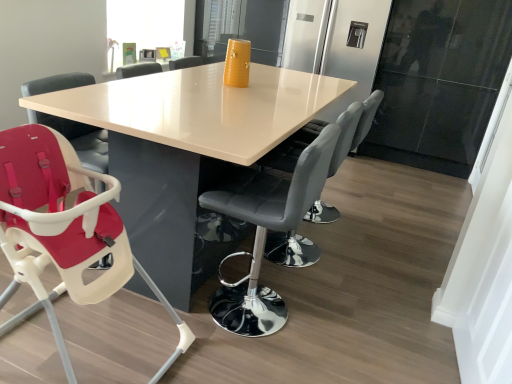
This screenshot has height=384, width=512. Find the location of `vacant point to the right of white glossy table at center`. vacant point to the right of white glossy table at center is located at coordinates (391, 249).